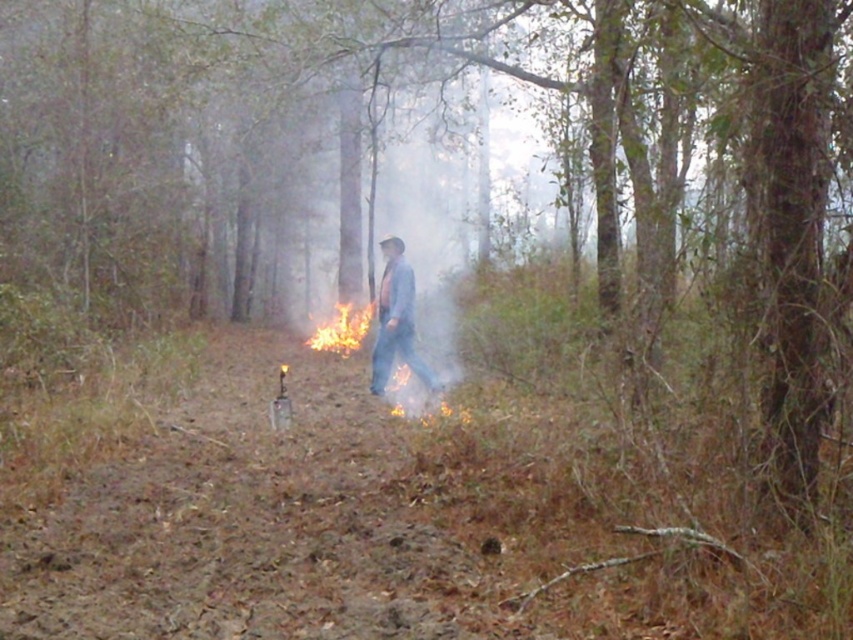
Question: Considering the relative positions of blue denim jeans at center and flame/yellow-orange at center in the image provided, where is blue denim jeans at center located with respect to flame/yellow-orange at center?

Choices:
 (A) left
 (B) right

Answer: (B)

Question: Observing the image, what is the correct spatial positioning of blue denim jeans at center in reference to flame/yellow-orange at center?

Choices:
 (A) above
 (B) below

Answer: (A)

Question: Which object appears closest to the camera in this image?

Choices:
 (A) flame/yellow-orange at center
 (B) blue denim jeans at center

Answer: (B)

Question: Which of the following is the farthest from the observer?

Choices:
 (A) blue denim jeans at center
 (B) flame/yellow-orange at center

Answer: (B)

Question: Can you confirm if blue denim jeans at center is wider than flame/yellow-orange at center?

Choices:
 (A) no
 (B) yes

Answer: (A)

Question: Among these objects, which one is farthest from the camera?

Choices:
 (A) flame/yellow-orange at center
 (B) blue denim jeans at center

Answer: (A)